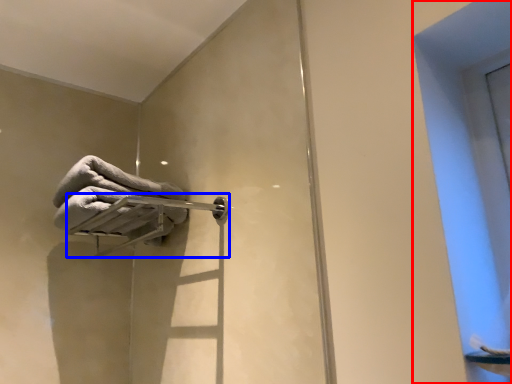
Question: Among these objects, which one is farthest to the camera, window (highlighted by a red box) or towel bar (highlighted by a blue box)?

Choices:
 (A) window
 (B) towel bar

Answer: (B)